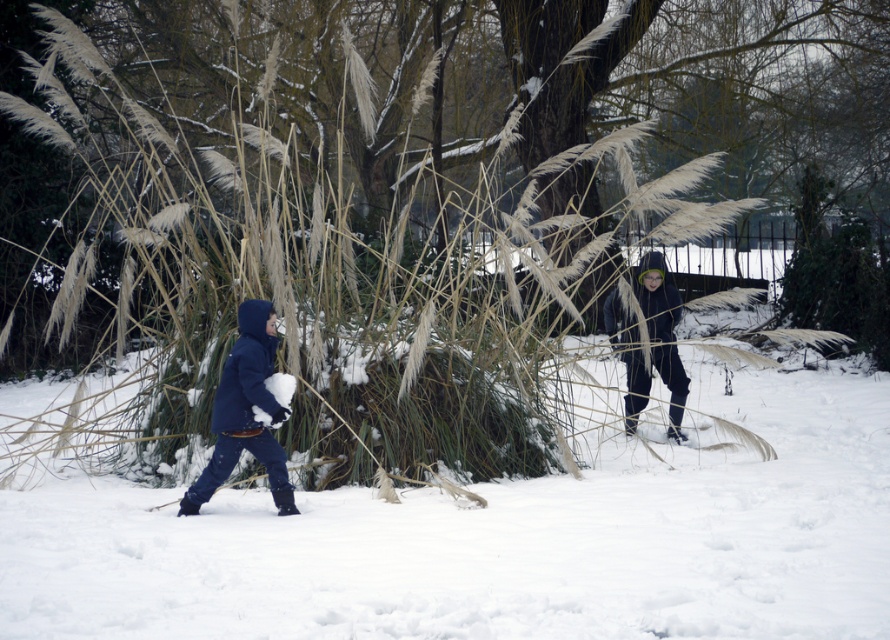
Question: Which object is the closest to the dark blue hooded jacket at center?

Choices:
 (A) white fluffy snow at center
 (B) matte blue coat at left

Answer: (A)

Question: Is white fluffy snow at center in front of matte blue coat at left?

Choices:
 (A) yes
 (B) no

Answer: (A)

Question: Can you confirm if matte blue coat at left is thinner than dark blue hooded jacket at center?

Choices:
 (A) yes
 (B) no

Answer: (A)

Question: Which point is closer to the camera?

Choices:
 (A) (659, 321)
 (B) (248, 332)
 (C) (832, 534)

Answer: (C)

Question: Among these objects, which one is nearest to the camera?

Choices:
 (A) dark blue hooded jacket at center
 (B) matte blue coat at left
 (C) white fluffy snow at center

Answer: (C)

Question: Can you confirm if matte blue coat at left is smaller than dark blue hooded jacket at center?

Choices:
 (A) yes
 (B) no

Answer: (A)